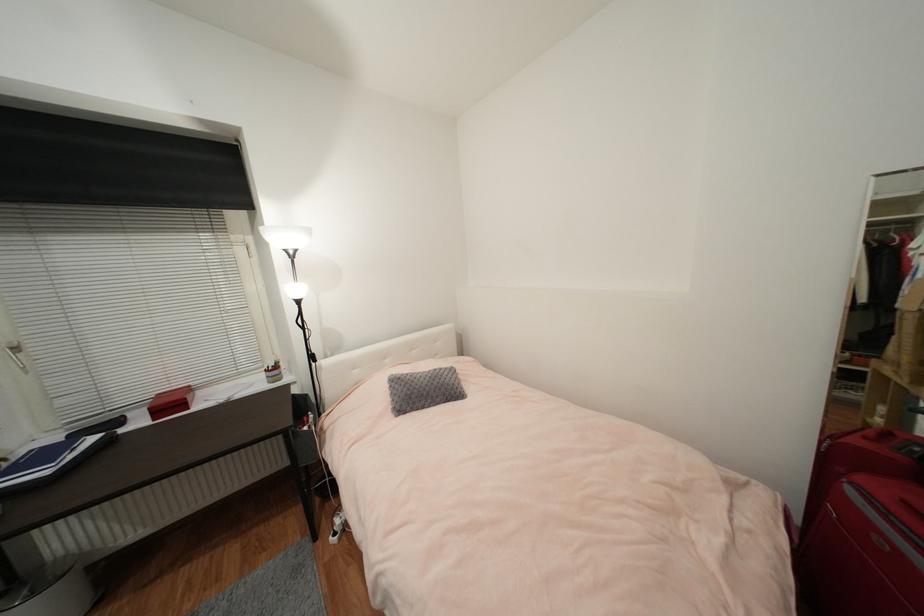
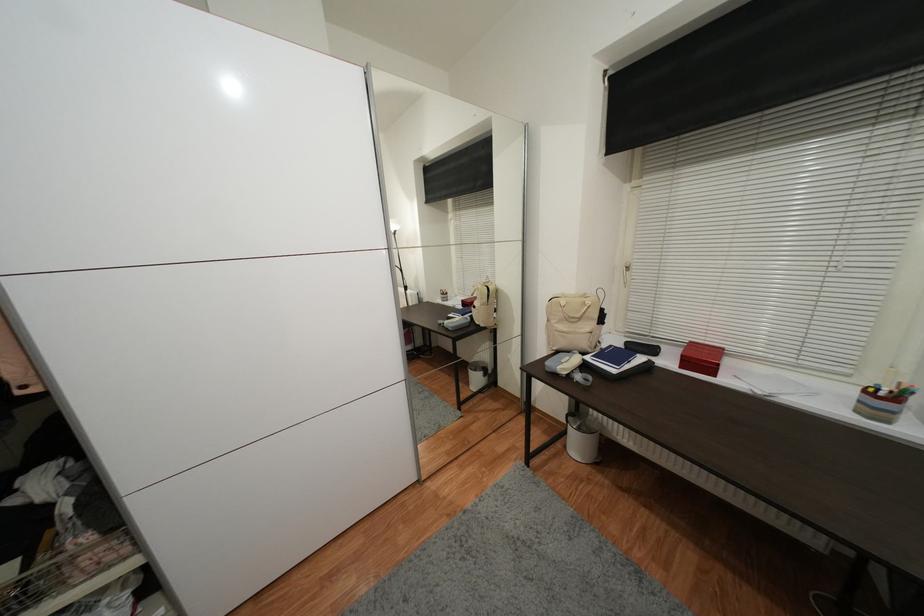
The point at (35, 232) is marked in the first image. Where is the corresponding point in the second image?

(678, 167)